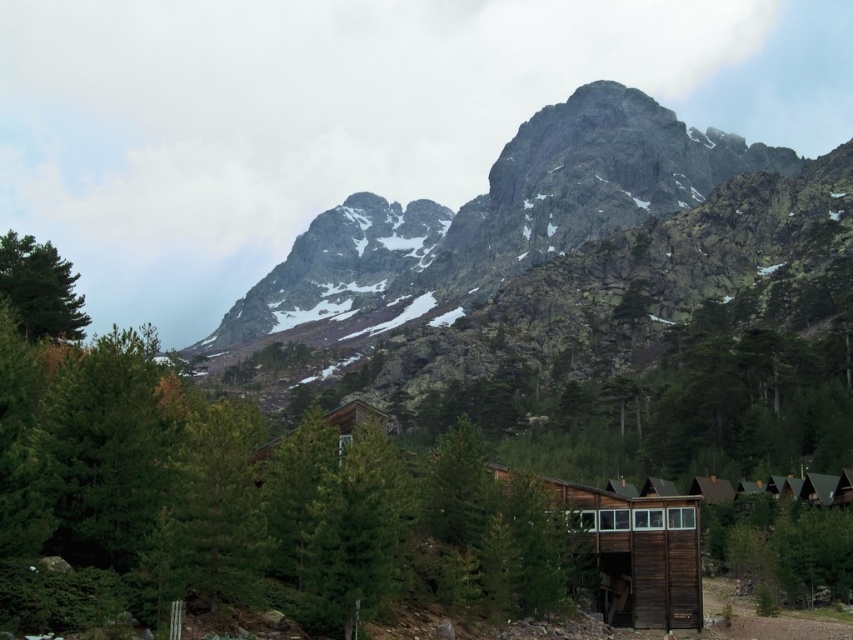
Between point (433, 483) and point (77, 307), which one is positioned in front?

Point (433, 483) is more forward.

Who is higher up, green matte tree at upper center or green matte tree at upper left?

green matte tree at upper left is higher up.

Between point (337, 604) and point (76, 275), which one is positioned behind?

The point (76, 275) is behind.

What are the coordinates of `green matte tree at upper center` in the screenshot? It's located at (239, 500).

Is wooden cabin at lower right bigger than green matte tree at upper left?

Correct, wooden cabin at lower right is larger in size than green matte tree at upper left.

Looking at this image, is wooden cabin at lower right taller than green matte tree at upper left?

Indeed, wooden cabin at lower right has a greater height compared to green matte tree at upper left.

What do you see at coordinates (639, 554) in the screenshot?
I see `wooden cabin at lower right` at bounding box center [639, 554].

Locate an element on the screen. wooden cabin at lower right is located at coordinates (639, 554).

Image resolution: width=853 pixels, height=640 pixels. Identify the location of green matte tree at upper center. click(239, 500).

Between point (115, 483) and point (695, 627), which one is positioned behind?

Positioned behind is point (695, 627).

What are the coordinates of `green matte tree at upper center` in the screenshot? It's located at (239, 500).